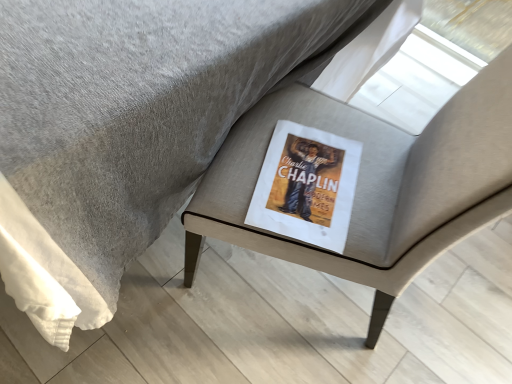
Find the location of a particular element. Image resolution: width=512 pixels, height=384 pixels. free space to the right of matte gray cushion at center is located at coordinates (454, 312).